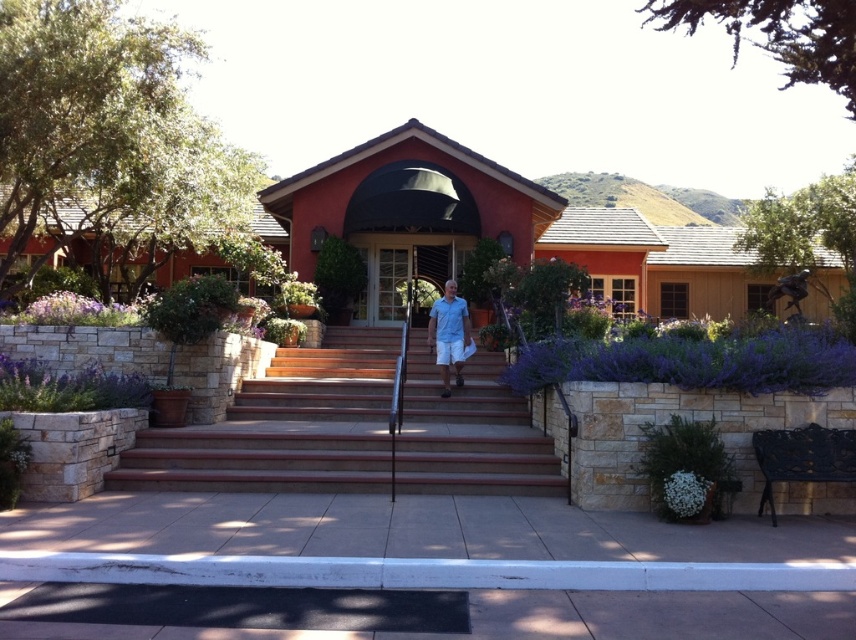
Image resolution: width=856 pixels, height=640 pixels. What do you see at coordinates (284, 426) in the screenshot?
I see `brown wooden stairs at center` at bounding box center [284, 426].

Does brown wooden stairs at center have a greater height compared to white fluffy flower at lower right?

No, brown wooden stairs at center is not taller than white fluffy flower at lower right.

Is point (322, 451) closer to camera compared to point (694, 484)?

No, it is not.

The width and height of the screenshot is (856, 640). I want to click on brown wooden stairs at center, so click(x=284, y=426).

The width and height of the screenshot is (856, 640). Describe the element at coordinates (75, 310) in the screenshot. I see `purple matte flower at lower left` at that location.

Consider the image. Is purple matte flower at lower left positioned at the back of light blue fabric shirt at center?

No, it is in front of light blue fabric shirt at center.

Who is more distant from viewer, (40, 301) or (456, 374)?

Positioned behind is point (456, 374).

Locate an element on the screen. This screenshot has width=856, height=640. purple matte flower at lower left is located at coordinates (75, 310).

Which is behind, point (631, 360) or point (91, 310)?

The point (91, 310) is behind.

Does purple leafy bush at right have a greater height compared to purple matte flower at lower left?

Incorrect, purple leafy bush at right's height is not larger of purple matte flower at lower left's.

You are a GUI agent. You are given a task and a screenshot of the screen. Output one action in this format:
    pyautogui.click(x=<x>, y=<y>)
    Task: Click on the purple leafy bush at right
    This screenshot has height=640, width=856.
    Given the screenshot: What is the action you would take?
    pyautogui.click(x=693, y=362)

Where is `purple leafy bush at right`? The width and height of the screenshot is (856, 640). purple leafy bush at right is located at coordinates (693, 362).